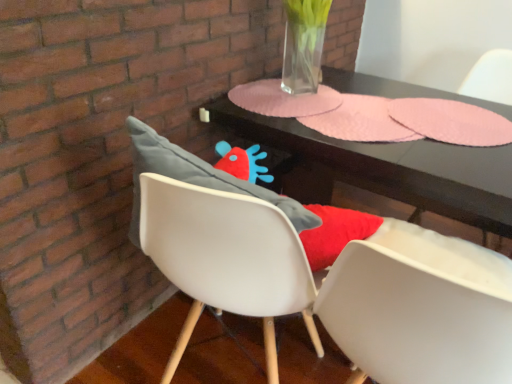
Question: Considering the positions of point (499, 226) and point (326, 218), is point (499, 226) closer or farther from the camera than point (326, 218)?

Choices:
 (A) farther
 (B) closer

Answer: (A)

Question: Is pink paper placemats at center to the left or to the right of matte gray cushion at center in the image?

Choices:
 (A) right
 (B) left

Answer: (B)

Question: Which object is positioned closest to the white matte armchair at upper right?

Choices:
 (A) matte gray cushion at center
 (B) pink paper placemats at center

Answer: (B)

Question: Which is farther from the matte gray cushion at center?

Choices:
 (A) white matte armchair at upper right
 (B) pink paper placemats at center

Answer: (A)